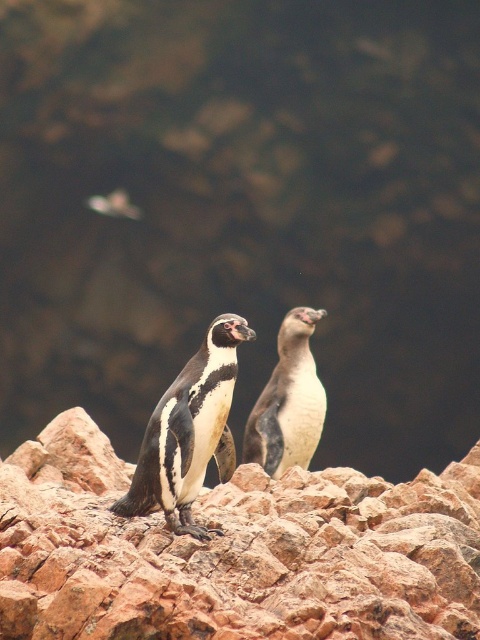
You are a photographer trying to capture a photo of both the black glossy penguin at center and the white matte penguin at center. Which penguin should you adjust your camera focus on first if you want to ensure the one closer to the front is sharp?

The black glossy penguin at center is positioned on the left side of white matte penguin at center, so you should focus on the black glossy penguin at center first as it is closer to the front.

You are a photographer trying to capture a closeup of the penguins in the image. The camera is currently focused on the point labeled as point (233, 552). According to the scene description, what object is the camera focused on?

The camera is focused on the rusty stone rocks at center, as point (233, 552) corresponds to rusty stone rocks at center.